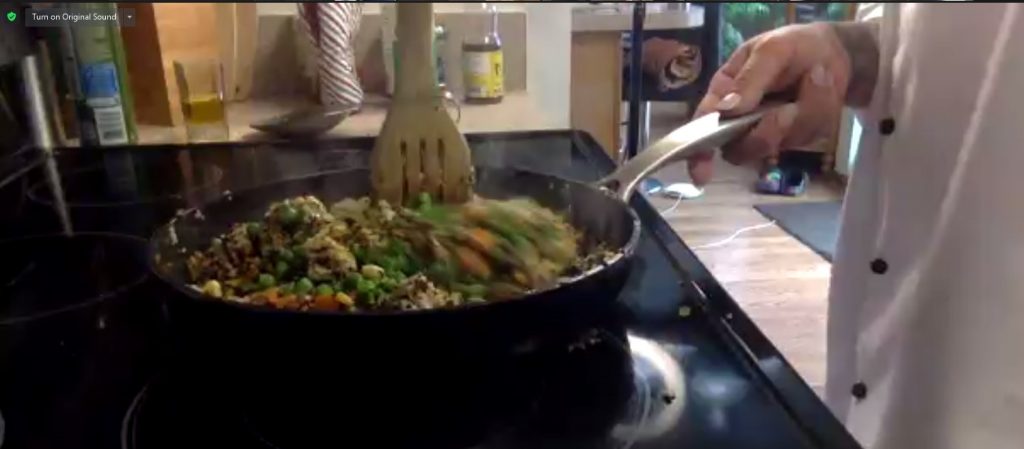
Locate an element on the screen. This screenshot has width=1024, height=449. stove top is located at coordinates (121, 212), (85, 374), (694, 400), (558, 155).